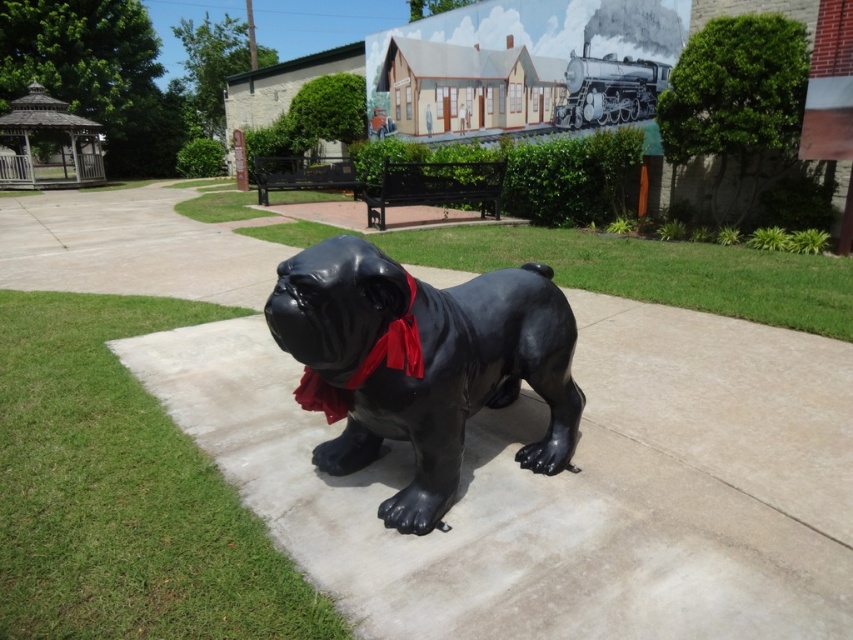
Question: Can you confirm if glossy black dog at center is positioned below red satin neckband at center?

Choices:
 (A) yes
 (B) no

Answer: (A)

Question: Is glossy black dog at center further to camera compared to red satin neckband at center?

Choices:
 (A) no
 (B) yes

Answer: (A)

Question: Is glossy black dog at center bigger than red satin neckband at center?

Choices:
 (A) yes
 (B) no

Answer: (A)

Question: Which point is closer to the camera?

Choices:
 (A) (317, 452)
 (B) (334, 397)

Answer: (B)

Question: Which object is closer to the camera taking this photo?

Choices:
 (A) glossy black dog at center
 (B) red satin neckband at center

Answer: (A)